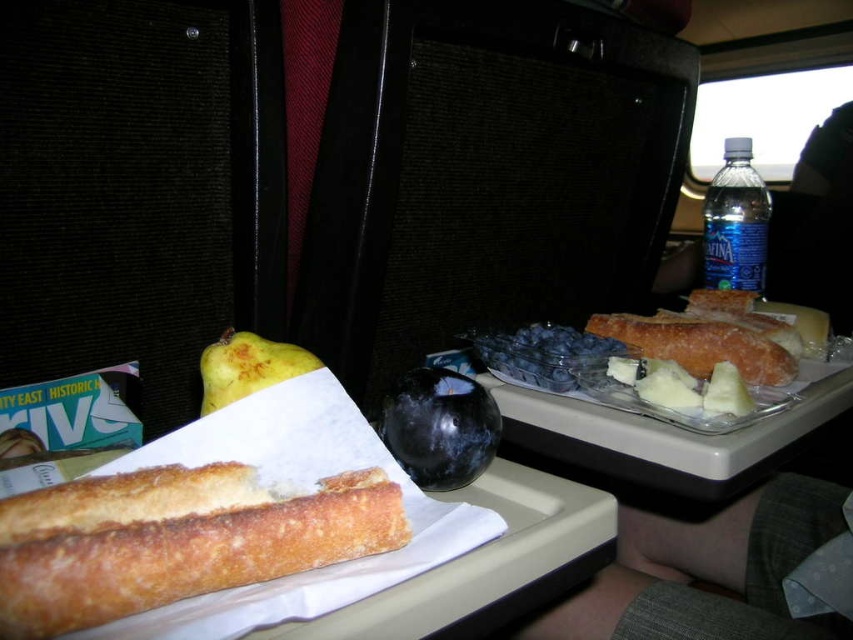
You are a flight attendant checking the tray table. You need to place a new item between the blue plastic bottle at upper right and the yellow matte quince at center. Is there space between them?

The blue plastic bottle at upper right is positioned over the yellow matte quince at center, meaning there is no space between them for placing a new item.

You are sitting in an airplane seat and looking at the tray table in front of you. There are two points marked on the tray table. The first point is at coordinates point (x=305, y=540) and the second point is at coordinates point (x=436, y=448). Which point is closer to you?

Point (x=305, y=540) is in front of point (x=436, y=448), so the first point is closer to you.